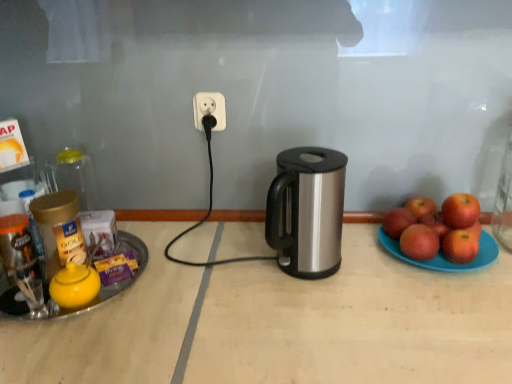
Question: In the image, is red matte apple at right, the sixth apple positioned from the back, positioned in front of or behind red matte apple at right, which is counted as the fourth apple, starting from the front?

Choices:
 (A) front
 (B) behind

Answer: (A)

Question: Looking at their shapes, would you say red matte apple at right, placed as the 1th apple when sorted from front to back, is wider or thinner than red matte apple at right, the third apple from the back?

Choices:
 (A) wide
 (B) thin

Answer: (B)

Question: Based on their relative distances, which object is farther from the red matte apple at right, placed as the sixth apple when sorted from front to back?

Choices:
 (A) metallic gold jar at left, which is the second bottle from front to back
 (B) blue plastic plate at right
 (C) transparent glass jar at left, positioned as the 1th bottle in back-to-front order
 (D) red matte apple at right, arranged as the second apple when viewed from the back
 (E) silver metallic kettle at center

Answer: (A)

Question: Which is nearer to the silver metallic kettle at center?

Choices:
 (A) red matte apple at right, arranged as the second apple when viewed from the back
 (B) silver metallic kettle at center
 (C) red matte apple at right, placed as the 1th apple when sorted from front to back
 (D) red matte apple at right, placed as the sixth apple when sorted from front to back
 (E) red matte apple at right, the fourth apple when ordered from back to front

Answer: (B)